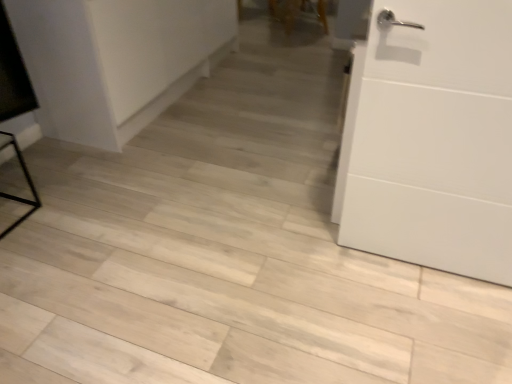
Where is `vacant space in front of white matte cabinet at upper left`? This screenshot has width=512, height=384. vacant space in front of white matte cabinet at upper left is located at coordinates (122, 188).